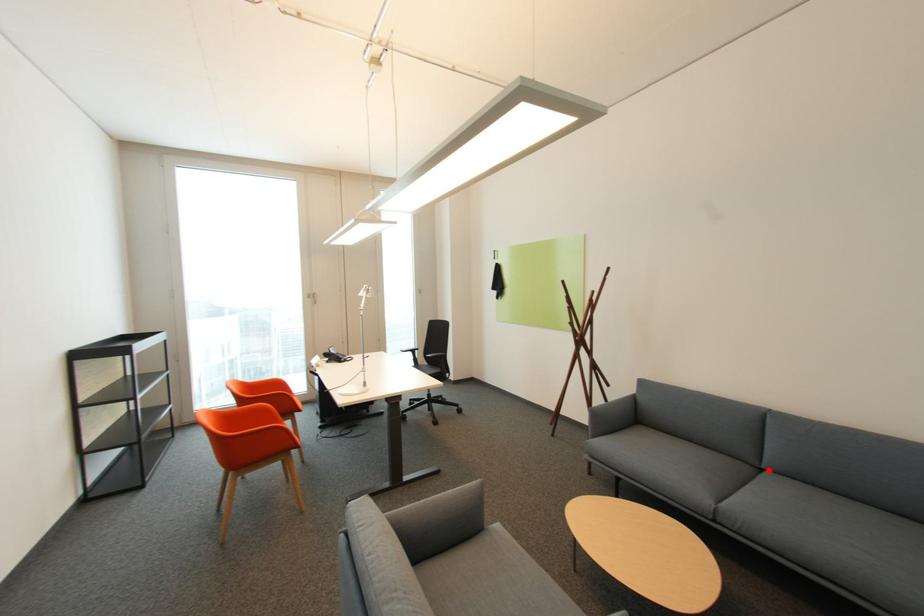
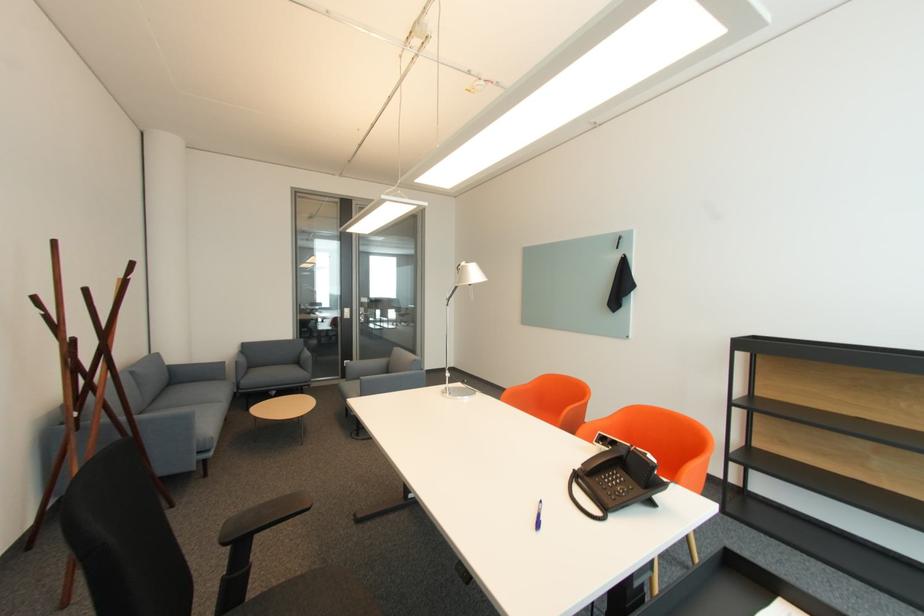
Question: A red point is marked in image1. In image2, is the corresponding 3D point closer to the camera or farther? Reply with the corresponding letter.

Choices:
 (A) The corresponding 3D point is closer.
 (B) The corresponding 3D point is farther.

Answer: (B)